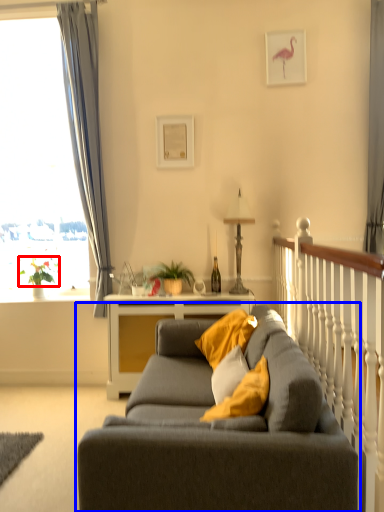
Question: Which point is further to the camera, plant (highlighted by a red box) or studio couch (highlighted by a blue box)?

Choices:
 (A) plant
 (B) studio couch

Answer: (A)